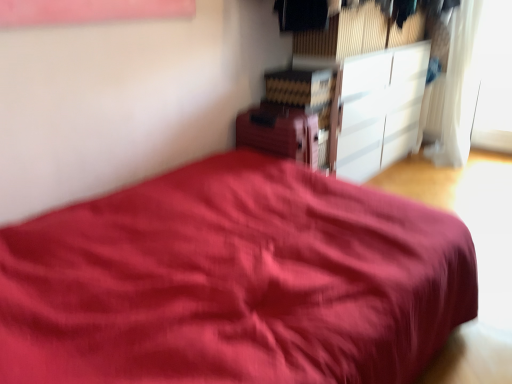
Question: From the image's perspective, would you say white glossy cabinet at upper right, the 2th cabinetry in the left-to-right sequence, is shown under white sheer curtain at upper right?

Choices:
 (A) no
 (B) yes

Answer: (B)

Question: Is white glossy cabinet at upper right, the 2th cabinetry in the left-to-right sequence, not within white sheer curtain at upper right?

Choices:
 (A) no
 (B) yes

Answer: (B)

Question: Is the surface of white glossy cabinet at upper right, placed as the 1th cabinetry when sorted from right to left, in direct contact with white sheer curtain at upper right?

Choices:
 (A) no
 (B) yes

Answer: (A)

Question: Does white glossy cabinet at upper right, which ranks as the 2th cabinetry in front-to-back order, have a lesser height compared to white sheer curtain at upper right?

Choices:
 (A) no
 (B) yes

Answer: (B)

Question: From the image's perspective, is white glossy cabinet at upper right, the 2th cabinetry in the left-to-right sequence, on top of white sheer curtain at upper right?

Choices:
 (A) yes
 (B) no

Answer: (B)

Question: Is white glossy cabinet at upper right, placed as the 1th cabinetry when sorted from right to left, in front of white sheer curtain at upper right?

Choices:
 (A) yes
 (B) no

Answer: (A)

Question: Does transparent glass window at upper right have a larger size compared to white glossy cabinet at upper right, which ranks as the 2th cabinetry in front-to-back order?

Choices:
 (A) no
 (B) yes

Answer: (A)

Question: Is transparent glass window at upper right facing away from white glossy cabinet at upper right, placed as the 1th cabinetry when sorted from right to left?

Choices:
 (A) no
 (B) yes

Answer: (A)

Question: Does transparent glass window at upper right turn towards white glossy cabinet at upper right, the 2th cabinetry in the left-to-right sequence?

Choices:
 (A) no
 (B) yes

Answer: (A)

Question: Considering the relative sizes of transparent glass window at upper right and white glossy cabinet at upper right, which ranks as the 2th cabinetry in front-to-back order, in the image provided, is transparent glass window at upper right smaller than white glossy cabinet at upper right, which ranks as the 2th cabinetry in front-to-back order,?

Choices:
 (A) yes
 (B) no

Answer: (A)

Question: From a real-world perspective, is transparent glass window at upper right on white glossy cabinet at upper right, which ranks as the 2th cabinetry in front-to-back order?

Choices:
 (A) no
 (B) yes

Answer: (B)

Question: Considering the relative positions of transparent glass window at upper right and white glossy cabinet at upper right, which is the first cabinetry from back to front, in the image provided, is transparent glass window at upper right to the left of white glossy cabinet at upper right, which is the first cabinetry from back to front, from the viewer's perspective?

Choices:
 (A) no
 (B) yes

Answer: (A)

Question: Can you confirm if white glossy cabinet at upper right, which is the first cabinetry from back to front, is positioned to the left of transparent glass window at upper right?

Choices:
 (A) no
 (B) yes

Answer: (B)